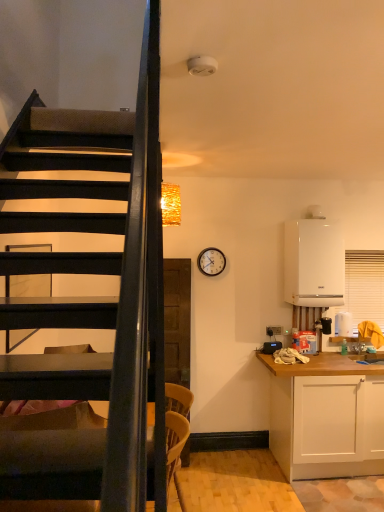
Question: From the image's perspective, is light brown woven chair at lower center below white matte cabinet at lower right?

Choices:
 (A) yes
 (B) no

Answer: (B)

Question: Considering the relative sizes of light brown woven chair at lower center and white matte cabinet at lower right in the image provided, is light brown woven chair at lower center smaller than white matte cabinet at lower right?

Choices:
 (A) no
 (B) yes

Answer: (B)

Question: Considering the relative sizes of light brown woven chair at lower center and white matte cabinet at lower right in the image provided, is light brown woven chair at lower center bigger than white matte cabinet at lower right?

Choices:
 (A) yes
 (B) no

Answer: (B)

Question: Is light brown woven chair at lower center at the right side of white matte cabinet at lower right?

Choices:
 (A) no
 (B) yes

Answer: (A)

Question: Is light brown woven chair at lower center facing away from white matte cabinet at lower right?

Choices:
 (A) yes
 (B) no

Answer: (B)

Question: Is point (218, 265) closer or farther from the camera than point (312, 296)?

Choices:
 (A) farther
 (B) closer

Answer: (A)

Question: Is wooden clock at upper center in front of or behind white glossy boiler at right in the image?

Choices:
 (A) front
 (B) behind

Answer: (B)

Question: Visually, is wooden clock at upper center positioned to the left or to the right of white glossy boiler at right?

Choices:
 (A) left
 (B) right

Answer: (A)

Question: Would you say wooden clock at upper center is inside or outside white glossy boiler at right?

Choices:
 (A) inside
 (B) outside

Answer: (B)

Question: Would you say light brown woven chair at lower center is to the left or to the right of wooden clock at upper center in the picture?

Choices:
 (A) left
 (B) right

Answer: (A)

Question: Is light brown woven chair at lower center taller or shorter than wooden clock at upper center?

Choices:
 (A) short
 (B) tall

Answer: (B)

Question: Is light brown woven chair at lower center situated inside wooden clock at upper center or outside?

Choices:
 (A) outside
 (B) inside

Answer: (A)

Question: From the image's perspective, relative to wooden clock at upper center, is light brown woven chair at lower center above or below?

Choices:
 (A) above
 (B) below

Answer: (B)

Question: Is light brown woven chair at lower center situated inside white matte cabinet at lower right or outside?

Choices:
 (A) outside
 (B) inside

Answer: (A)

Question: Is light brown woven chair at lower center to the left or to the right of white matte cabinet at lower right in the image?

Choices:
 (A) left
 (B) right

Answer: (A)